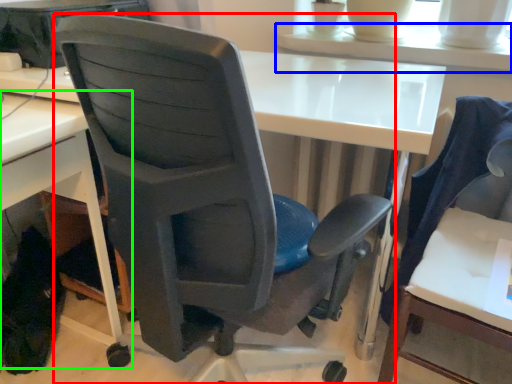
Question: Based on their relative distances, which object is nearer to chair (highlighted by a red box)? Choose from table (highlighted by a blue box) and desk (highlighted by a green box).

Choices:
 (A) table
 (B) desk

Answer: (B)